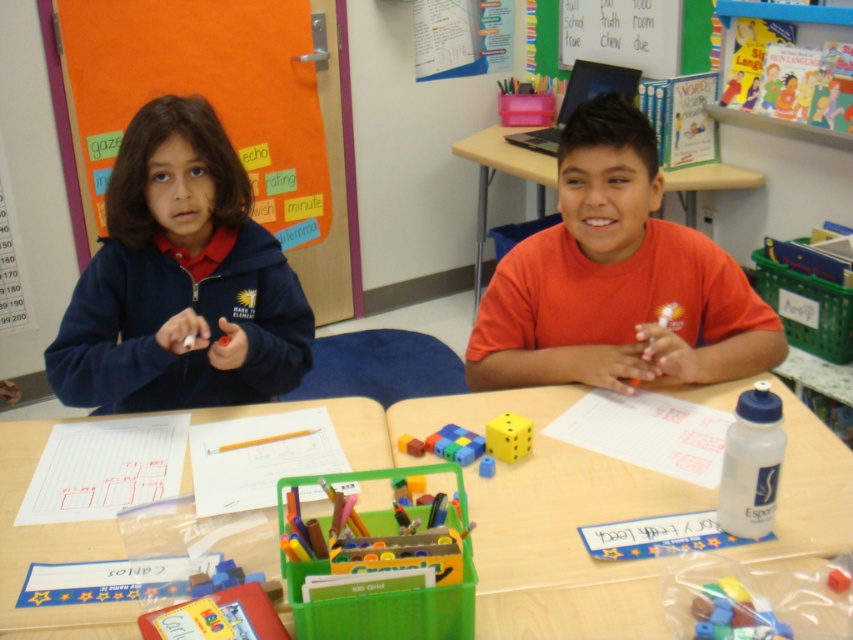
Can you confirm if wooden table at center is bigger than orange matte shirt at center?

Correct, wooden table at center is larger in size than orange matte shirt at center.

Does wooden table at center appear over orange matte shirt at center?

No.

Locate an element on the screen. The height and width of the screenshot is (640, 853). wooden table at center is located at coordinates (535, 515).

Who is higher up, orange matte bulletin board at upper left or translucent plastic blocks at center?

Positioned higher is orange matte bulletin board at upper left.

Where is `orange matte bulletin board at upper left`? orange matte bulletin board at upper left is located at coordinates (334, 184).

Who is positioned more to the right, orange matte shirt at center or orange matte bulletin board at upper left?

orange matte shirt at center is more to the right.

Does orange matte shirt at center have a lesser width compared to orange matte bulletin board at upper left?

In fact, orange matte shirt at center might be wider than orange matte bulletin board at upper left.

Locate an element on the screen. The image size is (853, 640). orange matte shirt at center is located at coordinates (616, 280).

This screenshot has height=640, width=853. What are the coordinates of `orange matte shirt at center` in the screenshot? It's located at (616, 280).